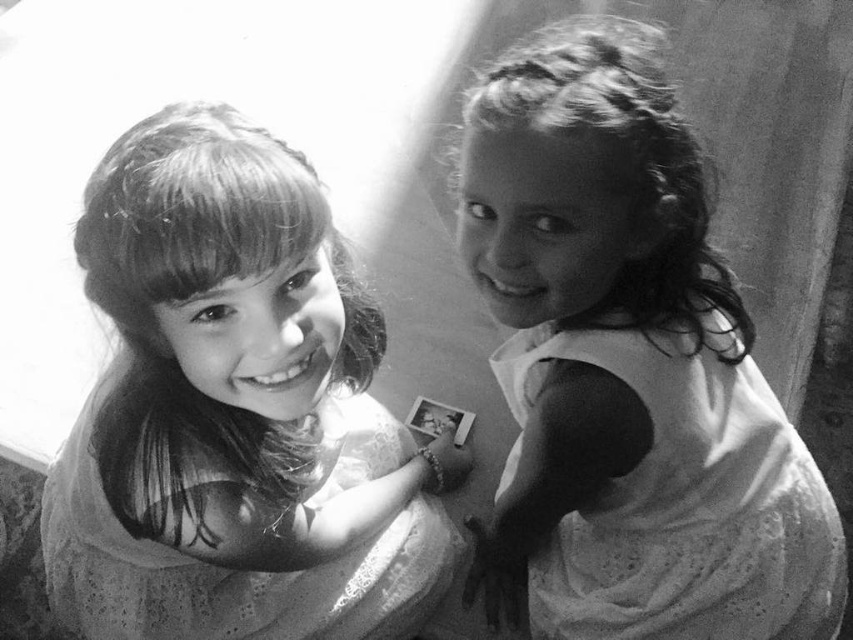
Question: Which point is closer to the camera taking this photo?

Choices:
 (A) (654, 426)
 (B) (57, 500)

Answer: (A)

Question: Which point is closer to the camera?

Choices:
 (A) smooth white dress at right
 (B) smooth fabric dress at upper left
 (C) white lace dress at right

Answer: (B)

Question: In this image, where is smooth white dress at right located relative to white lace dress at right?

Choices:
 (A) above
 (B) below

Answer: (A)

Question: Which point appears closest to the camera in this image?

Choices:
 (A) (x=550, y=596)
 (B) (x=131, y=531)

Answer: (B)

Question: Does smooth white dress at right appear on the left side of white lace dress at right?

Choices:
 (A) no
 (B) yes

Answer: (B)

Question: Considering the relative positions of smooth white dress at right and white lace dress at right in the image provided, where is smooth white dress at right located with respect to white lace dress at right?

Choices:
 (A) above
 (B) below

Answer: (A)